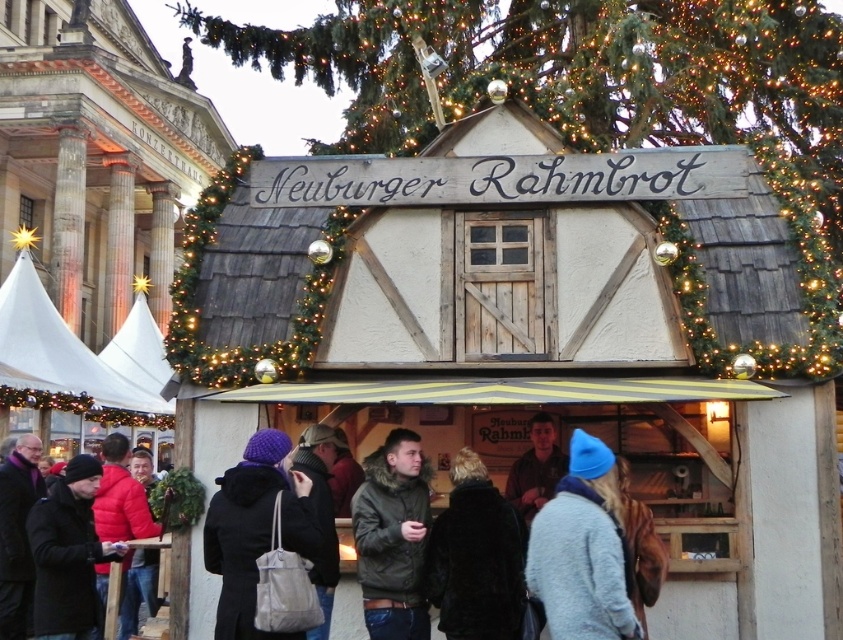
Question: Among these objects, which one is farthest from the camera?

Choices:
 (A) white fabric canopy at lower left
 (B) velvet black coat at center
 (C) brown leather jacket at center

Answer: (A)

Question: Does knitted purple hat at center lie in front of dark gray woolen coat at center?

Choices:
 (A) no
 (B) yes

Answer: (A)

Question: Does dark green textured jacket at center appear over black matte coat at lower left?

Choices:
 (A) no
 (B) yes

Answer: (B)

Question: Does velvet black coat at center have a lesser width compared to knitted purple hat at center?

Choices:
 (A) no
 (B) yes

Answer: (A)

Question: Which point is farther to the camera?

Choices:
 (A) illuminated garland at center
 (B) white fabric canopy at lower left
 (C) velvet black coat at center
 (D) dark gray woolen coat at center

Answer: (B)

Question: Which object appears closest to the camera in this image?

Choices:
 (A) illuminated garland at center
 (B) velvet black coat at center

Answer: (B)